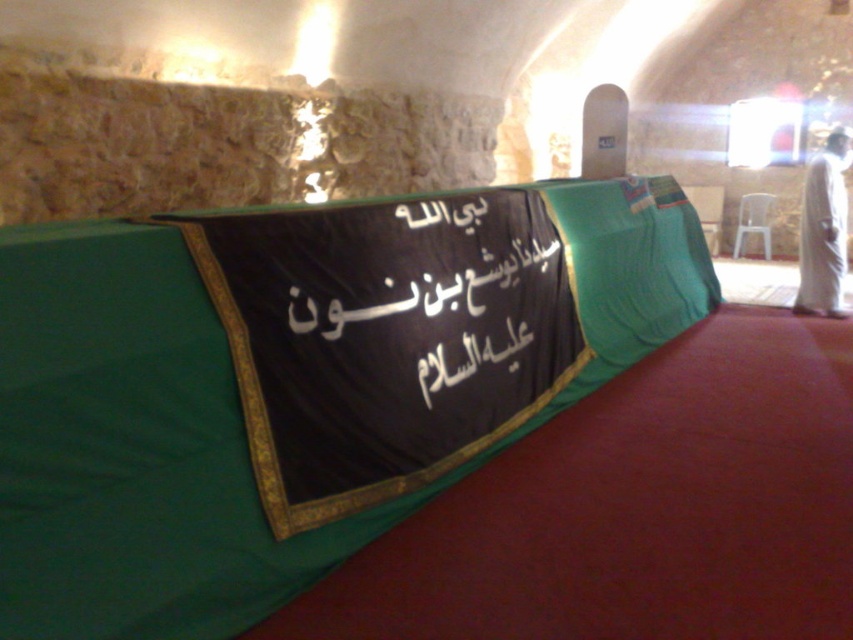
You are an interior designer tasked with arranging a new decorative element between the green fabric at center and the black fabric text at center. Given their widths, which object should you place closer to the narrower one to maintain balance?

The black fabric text at center is narrower than the green fabric at center. To maintain balance, place the new decorative element closer to the black fabric text at center since it is narrower.

You are planning to place a small vase between the green fabric at center and the white clothed figure at right in the tomb. Considering their positions, which object should the vase be closer to if you want it near the taller one?

The green fabric at center is much taller than the white clothed figure at right, so the vase should be placed closer to the green fabric at center.

You are planning to take a photo of the black fabric text at center and the white clothed figure at right for a historical record. Which object should you focus on first if you want to capture the larger subject in detail?

The black fabric text at center is bigger than the white clothed figure at right, so you should focus on the black fabric text at center first to capture its details.